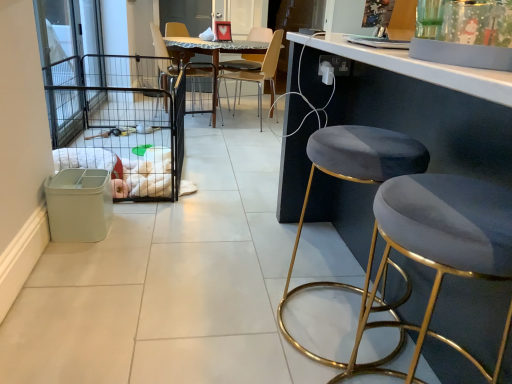
What is the approximate width of wooden chair at center, which is counted as the 1th chair, starting from the right?

The width of wooden chair at center, which is counted as the 1th chair, starting from the right, is 19.15 inches.

What do you see at coordinates (440, 248) in the screenshot? This screenshot has width=512, height=384. I see `velvet/golden stool at right, the second stool positioned from the back` at bounding box center [440, 248].

What is the approximate height of black wire cage at left?

It is 23.99 inches.

Locate an element on the screen. velvet/golden stool at right, the 1th stool in the back-to-front sequence is located at coordinates (352, 181).

From a real-world perspective, between velvet/golden stool at right, the 1th stool in the front-to-back sequence, and clear glass screen door at left, who is vertically lower?

velvet/golden stool at right, the 1th stool in the front-to-back sequence, is physically lower.

Which object is positioned more to the left, velvet/golden stool at right, the second stool positioned from the back, or clear glass screen door at left?

clear glass screen door at left is more to the left.

What's the angular difference between velvet/golden stool at right, the second stool positioned from the back, and clear glass screen door at left's facing directions?

0.343 degrees.

Consider the image. Is velvet/golden stool at right, the second stool positioned from the back, turned away from clear glass screen door at left?

velvet/golden stool at right, the second stool positioned from the back, is not turned away from clear glass screen door at left.

Consider the image. How different are the orientations of black wire cage at left and velvet/golden stool at right, positioned as the second stool in front-to-back order, in degrees?

The angular difference between black wire cage at left and velvet/golden stool at right, positioned as the second stool in front-to-back order, is 0.772 degrees.

Is black wire cage at left looking in the opposite direction of velvet/golden stool at right, positioned as the second stool in front-to-back order?

No, black wire cage at left's orientation is not away from velvet/golden stool at right, positioned as the second stool in front-to-back order.

From a real-world perspective, is black wire cage at left located higher than velvet/golden stool at right, positioned as the second stool in front-to-back order?

Actually, black wire cage at left is physically below velvet/golden stool at right, positioned as the second stool in front-to-back order, in the real world.

From the image's perspective, is black wire cage at left located beneath velvet/golden stool at right, the 1th stool in the back-to-front sequence?

No.

From a real-world perspective, which is physically below, wooden chair at center, which is counted as the 1th chair, starting from the right, or velvet/golden stool at right, the 1th stool in the back-to-front sequence?

velvet/golden stool at right, the 1th stool in the back-to-front sequence, is physically lower.

Based on the photo, is there a large distance between wooden chair at center, which appears as the 2th chair when viewed from the left, and velvet/golden stool at right, the 1th stool in the back-to-front sequence?

Indeed, wooden chair at center, which appears as the 2th chair when viewed from the left, is not near velvet/golden stool at right, the 1th stool in the back-to-front sequence.

Considering their positions, is wooden chair at center, which is counted as the 1th chair, starting from the right, located in front of or behind velvet/golden stool at right, positioned as the second stool in front-to-back order?

In the image, wooden chair at center, which is counted as the 1th chair, starting from the right, appears behind velvet/golden stool at right, positioned as the second stool in front-to-back order.

Which is behind, wooden chair at center, which appears as the 2th chair when viewed from the left, or velvet/golden stool at right, the 1th stool in the front-to-back sequence?

Positioned behind is wooden chair at center, which appears as the 2th chair when viewed from the left.

Identify the location of stool that is the 2nd object located in front of the wooden chair at center, which is counted as the 1th chair, starting from the right. (440, 248).

Does point (228, 72) lie behind point (453, 231)?

Yes, point (228, 72) is behind point (453, 231).

Is point (183, 35) less distant than point (77, 112)?

No, (183, 35) is further to viewer.

Is metallic brown chair at upper center, the second chair positioned from the right, oriented away from black wire cage at left?

metallic brown chair at upper center, the second chair positioned from the right, is not turned away from black wire cage at left.

Could you measure the distance between metallic brown chair at upper center, the second chair positioned from the right, and black wire cage at left?

They are 31.85 inches apart.

How different are the orientations of metallic brown chair at upper center, which ranks as the first chair in left-to-right order, and black wire cage at left in degrees?

The angle between the facing direction of metallic brown chair at upper center, which ranks as the first chair in left-to-right order, and the facing direction of black wire cage at left is 16.8 degrees.

Considering the points (367, 153) and (240, 74), which point is behind, point (367, 153) or point (240, 74)?

Positioned behind is point (240, 74).

Identify the location of the 2nd chair behind the velvet/golden stool at right, positioned as the second stool in front-to-back order, starting your count from the anchor. The width and height of the screenshot is (512, 384). (258, 74).

Is velvet/golden stool at right, the 1th stool in the back-to-front sequence, placed right next to wooden chair at center, which appears as the 2th chair when viewed from the left?

There is a gap between velvet/golden stool at right, the 1th stool in the back-to-front sequence, and wooden chair at center, which appears as the 2th chair when viewed from the left.

Would you say velvet/golden stool at right, positioned as the second stool in front-to-back order, is inside or outside wooden chair at center, which appears as the 2th chair when viewed from the left?

velvet/golden stool at right, positioned as the second stool in front-to-back order, lies outside wooden chair at center, which appears as the 2th chair when viewed from the left.

Which is farther, (464, 207) or (342, 136)?

Point (342, 136)

Can we say velvet/golden stool at right, the 1th stool in the front-to-back sequence, lies outside velvet/golden stool at right, the 1th stool in the back-to-front sequence?

Yes, velvet/golden stool at right, the 1th stool in the front-to-back sequence, is located beyond the bounds of velvet/golden stool at right, the 1th stool in the back-to-front sequence.

Measure the distance from velvet/golden stool at right, the 1th stool in the front-to-back sequence, to velvet/golden stool at right, positioned as the second stool in front-to-back order.

They are 11.57 inches apart.

Are velvet/golden stool at right, the 1th stool in the front-to-back sequence, and velvet/golden stool at right, positioned as the second stool in front-to-back order, beside each other?

No, velvet/golden stool at right, the 1th stool in the front-to-back sequence, is not with velvet/golden stool at right, positioned as the second stool in front-to-back order.

Identify the location of the 2nd stool in front of the clear glass screen door at left. The image size is (512, 384). (440, 248).

At what (x,y) coordinates should I click in order to perform the action: click on cage above the velvet/golden stool at right, the 1th stool in the back-to-front sequence (from the image's perspective). Please return your answer as a coordinate pair (x, y). Looking at the image, I should click on (120, 122).

Which object lies nearer to the anchor point velvet/golden stool at right, positioned as the second stool in front-to-back order, clear glass screen door at left or metallic brown chair at upper center, which ranks as the first chair in left-to-right order?

Based on the image, clear glass screen door at left appears to be nearer to velvet/golden stool at right, positioned as the second stool in front-to-back order.

Based on their spatial positions, is velvet/golden stool at right, the 1th stool in the back-to-front sequence, or velvet/golden stool at right, the 1th stool in the front-to-back sequence, further from wooden chair at center, which appears as the 2th chair when viewed from the left?

velvet/golden stool at right, the 1th stool in the front-to-back sequence, is positioned further to the anchor wooden chair at center, which appears as the 2th chair when viewed from the left.

Estimate the real-world distances between objects in this image. Which object is further from black wire cage at left, velvet/golden stool at right, the 1th stool in the back-to-front sequence, or wooden chair at center, which is counted as the 1th chair, starting from the right?

The object further to black wire cage at left is velvet/golden stool at right, the 1th stool in the back-to-front sequence.

Which object lies further to the anchor point wooden chair at center, which appears as the 2th chair when viewed from the left, velvet/golden stool at right, the 1th stool in the front-to-back sequence, or black wire cage at left?

velvet/golden stool at right, the 1th stool in the front-to-back sequence, lies further to wooden chair at center, which appears as the 2th chair when viewed from the left, than the other object.

Estimate the real-world distances between objects in this image. Which object is further from wooden chair at center, which is counted as the 1th chair, starting from the right, clear glass screen door at left or velvet/golden stool at right, the 1th stool in the back-to-front sequence?

Among the two, velvet/golden stool at right, the 1th stool in the back-to-front sequence, is located further to wooden chair at center, which is counted as the 1th chair, starting from the right.

When comparing their distances from metallic brown chair at upper center, which ranks as the first chair in left-to-right order, does clear glass screen door at left or black wire cage at left seem further?

Among the two, clear glass screen door at left is located further to metallic brown chair at upper center, which ranks as the first chair in left-to-right order.

Looking at the image, which one is located further to metallic brown chair at upper center, which ranks as the first chair in left-to-right order, velvet/golden stool at right, positioned as the second stool in front-to-back order, or clear glass screen door at left?

The object further to metallic brown chair at upper center, which ranks as the first chair in left-to-right order, is velvet/golden stool at right, positioned as the second stool in front-to-back order.

Which object lies nearer to the anchor point velvet/golden stool at right, positioned as the second stool in front-to-back order, black wire cage at left or metallic brown chair at upper center, the second chair positioned from the right?

black wire cage at left lies closer to velvet/golden stool at right, positioned as the second stool in front-to-back order, than the other object.

Image resolution: width=512 pixels, height=384 pixels. Find the location of `stool between velvet/golden stool at right, the 1th stool in the front-to-back sequence, and clear glass screen door at left, along the z-axis`. stool between velvet/golden stool at right, the 1th stool in the front-to-back sequence, and clear glass screen door at left, along the z-axis is located at coordinates (352, 181).

Find the location of a particular element. The height and width of the screenshot is (384, 512). screen door positioned between velvet/golden stool at right, the 1th stool in the back-to-front sequence, and wooden chair at center, which appears as the 2th chair when viewed from the left, from near to far is located at coordinates (70, 63).

Image resolution: width=512 pixels, height=384 pixels. I want to click on stool located between velvet/golden stool at right, the 1th stool in the front-to-back sequence, and wooden chair at center, which appears as the 2th chair when viewed from the left, in the depth direction, so click(352, 181).

Find the location of a particular element. The width and height of the screenshot is (512, 384). stool located between velvet/golden stool at right, the second stool positioned from the back, and black wire cage at left in the depth direction is located at coordinates point(352,181).